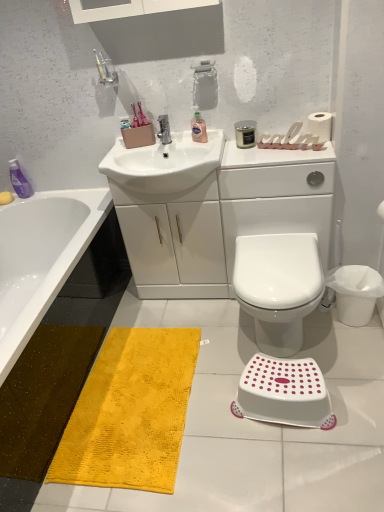
What do you see at coordinates (164, 129) in the screenshot? I see `metallic faucet at center` at bounding box center [164, 129].

Measure the distance between metallic faucet at center and camera.

metallic faucet at center and camera are 6.62 feet apart from each other.

Locate an element on the screen. matte white bathtub at lower left is located at coordinates (41, 258).

Where is `purple glossy bottle at upper left, marked as the 1th toiletry in a bottom-to-top arrangement`? This screenshot has height=512, width=384. purple glossy bottle at upper left, marked as the 1th toiletry in a bottom-to-top arrangement is located at coordinates (19, 180).

At what (x,y) coordinates should I click in order to perform the action: click on yellow textured mat at lower left. Please return your answer as a coordinate pair (x, y). The image size is (384, 512). Looking at the image, I should click on (130, 412).

The width and height of the screenshot is (384, 512). Find the location of `white glossy sink at center`. white glossy sink at center is located at coordinates (163, 166).

Between matte white bathtub at lower left and translucent pink liquid at sink, which is the first toiletry in right-to-left order, which one has less height?

translucent pink liquid at sink, which is the first toiletry in right-to-left order, is shorter.

From the image's perspective, is matte white bathtub at lower left located above or below translucent pink liquid at sink, the 2th toiletry viewed from the left?

From the image's perspective, matte white bathtub at lower left appears below translucent pink liquid at sink, the 2th toiletry viewed from the left.

From the picture: Is matte white bathtub at lower left not close to translucent pink liquid at sink, arranged as the 2th toiletry when ordered from the bottom?

matte white bathtub at lower left is near translucent pink liquid at sink, arranged as the 2th toiletry when ordered from the bottom, not far away.

Which point is more forward, (158, 285) or (164, 461)?

Positioned in front is point (164, 461).

Who is shorter, white glossy cabinet at center or yellow textured mat at lower left?

Standing shorter between the two is yellow textured mat at lower left.

Could yellow textured mat at lower left be considered to be inside white glossy cabinet at center?

No, yellow textured mat at lower left is located outside of white glossy cabinet at center.

From a real-world perspective, between white glossy cabinet at center and yellow textured mat at lower left, who is vertically lower?

yellow textured mat at lower left, from a real-world perspective.

Between purple glossy bottle at upper left, which is the 2th toiletry from front to back, and white matte toilet paper at upper right, which one appears on the left side from the viewer's perspective?

purple glossy bottle at upper left, which is the 2th toiletry from front to back.

Is purple glossy bottle at upper left, the first toiletry viewed from the back, facing away from white matte toilet paper at upper right?

No.

The height and width of the screenshot is (512, 384). Identify the location of toilet paper above the purple glossy bottle at upper left, which is the 2th toiletry from front to back (from a real-world perspective). (320, 126).

Is point (97, 451) less distant than point (327, 131)?

That is True.

In the scene shown: Is yellow textured mat at lower left not close to white matte toilet paper at upper right?

Yes, yellow textured mat at lower left and white matte toilet paper at upper right are quite far apart.

Based on the photo, can you tell me how much yellow textured mat at lower left and white matte toilet paper at upper right differ in facing direction?

They differ by 110 degrees in their facing directions.

What are the coordinates of `step stool that appears on the right of white glossy cabinet at center` in the screenshot? It's located at (284, 393).

Can you confirm if white glossy cabinet at center is positioned to the right of white plastic step stool at lower right?

Incorrect, white glossy cabinet at center is not on the right side of white plastic step stool at lower right.

Is white glossy cabinet at center situated inside white plastic step stool at lower right or outside?

white glossy cabinet at center is located beyond the bounds of white plastic step stool at lower right.

Is metallic faucet at center not within white plastic step stool at lower right?

metallic faucet at center lies outside white plastic step stool at lower right's area.

Considering the points (160, 122) and (308, 425), which point is behind, point (160, 122) or point (308, 425)?

The point (160, 122) is more distant.

In terms of height, does metallic faucet at center look taller or shorter compared to white plastic step stool at lower right?

metallic faucet at center is shorter than white plastic step stool at lower right.

Considering the relative positions of yellow textured mat at lower left and white glossy toilet at center in the image provided, is yellow textured mat at lower left to the left of white glossy toilet at center from the viewer's perspective?

Yes, yellow textured mat at lower left is to the left of white glossy toilet at center.

Would you consider yellow textured mat at lower left to be distant from white glossy toilet at center?

They are positioned close to each other.

From the image's perspective, which one is positioned higher, yellow textured mat at lower left or white glossy toilet at center?

white glossy toilet at center, from the image's perspective.

The height and width of the screenshot is (512, 384). In order to click on the 2nd toiletry above when counting from the matte white bathtub at lower left (from the image's perspective) in this screenshot , I will do `click(199, 129)`.

Find the location of `counter top to the right of yellow textured mat at lower left`. counter top to the right of yellow textured mat at lower left is located at coordinates (213, 209).

Based on their spatial positions, is matte white bathtub at lower left or white glossy cabinet at center closer to translucent pink liquid at sink, which ranks as the second toiletry in back-to-front order?

Among the two, white glossy cabinet at center is located nearer to translucent pink liquid at sink, which ranks as the second toiletry in back-to-front order.

Estimate the real-world distances between objects in this image. Which object is further from matte white bathtub at lower left, yellow textured mat at lower left or white plastic step stool at lower right?

The object further to matte white bathtub at lower left is white plastic step stool at lower right.

Estimate the real-world distances between objects in this image. Which object is closer to matte white bathtub at lower left, white matte toilet paper at upper right or purple glossy bottle at upper left, the first toiletry viewed from the back?

purple glossy bottle at upper left, the first toiletry viewed from the back.

Estimate the real-world distances between objects in this image. Which object is closer to white glossy sink at center, metallic faucet at center or translucent pink liquid at sink, which ranks as the second toiletry in back-to-front order?

Based on the image, metallic faucet at center appears to be nearer to white glossy sink at center.

Considering their positions, is white glossy toilet at center positioned closer to white glossy cabinet at center than white glossy sink at center?

The object closer to white glossy cabinet at center is white glossy sink at center.

From the image, which object appears to be farther from white glossy toilet at center, white matte toilet paper at upper right or white glossy cabinet at center?

white matte toilet paper at upper right lies further to white glossy toilet at center than the other object.

When comparing their distances from purple glossy bottle at upper left, the first toiletry viewed from the back, does metallic faucet at center or matte white bathtub at lower left seem further?

metallic faucet at center is positioned further to the anchor purple glossy bottle at upper left, the first toiletry viewed from the back.

From the image, which object appears to be farther from white matte toilet paper at upper right, purple glossy bottle at upper left, marked as the 1th toiletry in a bottom-to-top arrangement, or yellow textured mat at lower left?

Among the two, purple glossy bottle at upper left, marked as the 1th toiletry in a bottom-to-top arrangement, is located further to white matte toilet paper at upper right.

The width and height of the screenshot is (384, 512). What are the coordinates of `toilet paper between translucent pink liquid at sink, the 2th toiletry viewed from the left, and white plastic step stool at lower right vertically` in the screenshot? It's located at [320, 126].

The image size is (384, 512). What are the coordinates of `bathtub between purple glossy bottle at upper left, the 2th toiletry when ordered from top to bottom, and white matte toilet paper at upper right` in the screenshot? It's located at (41, 258).

Where is `sink that lies between white matte toilet paper at upper right and white glossy toilet at center from top to bottom`? sink that lies between white matte toilet paper at upper right and white glossy toilet at center from top to bottom is located at coordinates (163, 166).

Locate an element on the screen. Image resolution: width=384 pixels, height=512 pixels. counter top between white matte toilet paper at upper right and yellow textured mat at lower left in the vertical direction is located at coordinates (213, 209).